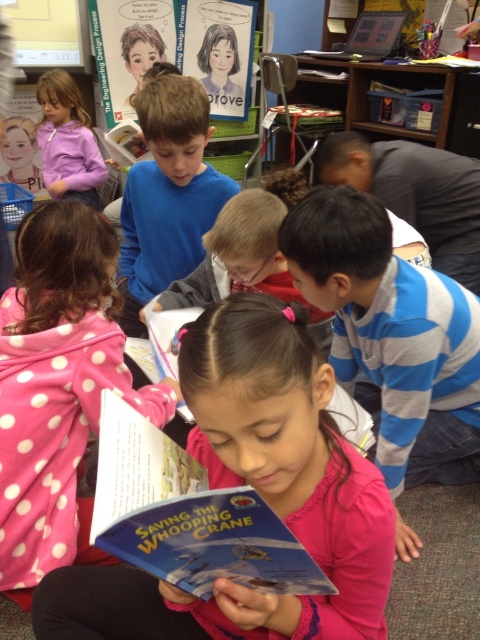
You are a student in the classroom and want to reach a book on the wooden bookshelf at upper center. The pink polka dot hoodie at center is blocking your path. Can you walk around it to access the bookshelf?

The pink polka dot hoodie at center is closer to the viewer than the wooden bookshelf at upper center, so you can walk around it to access the wooden bookshelf at upper center.

You are a student in the classroom and want to grab the blue paper book at center and the hardcover book at center. Which one can you reach first without moving your position?

The blue paper book at center is closer to the viewer than the hardcover book at center, so you can reach the blue paper book at center first without moving your position.

You are a student in the classroom and want to reach a book on the wooden bookshelf at upper center. The pink polka dot hoodie at center is in your way. Can you walk around it to access the bookshelf?

The pink polka dot hoodie at center is below the wooden bookshelf at upper center, so you can walk around the pink polka dot hoodie at center to access the wooden bookshelf at upper center.